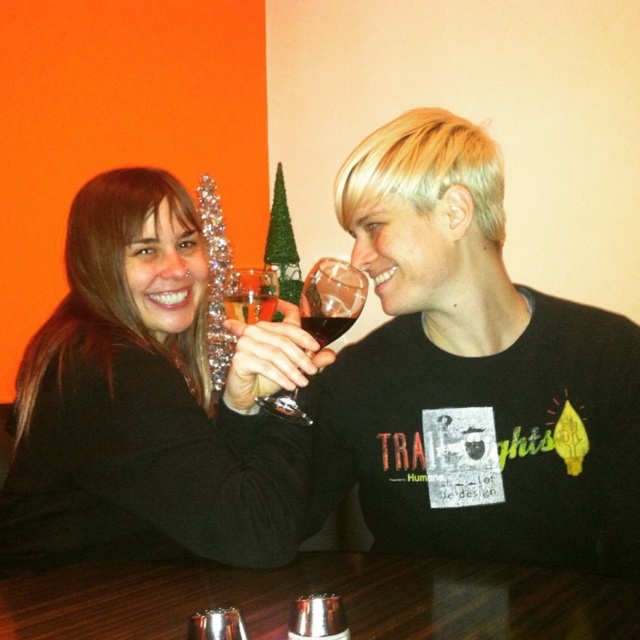
Between matte black shirt at center and translucent glass wine at center, which one appears on the left side from the viewer's perspective?

translucent glass wine at center is more to the left.

Does matte black shirt at center appear under translucent glass wine at center?

Yes.

What are the coordinates of `matte black shirt at center` in the screenshot? It's located at (472, 372).

Locate an element on the screen. matte black shirt at center is located at coordinates (x=472, y=372).

Which is in front, point (301, 493) or point (312, 273)?

Point (301, 493)

You are a GUI agent. You are given a task and a screenshot of the screen. Output one action in this format:
    pyautogui.click(x=<x>, y=<y>)
    Task: Click on the matte black wine glass at upper left
    
    Given the screenshot: What is the action you would take?
    pyautogui.click(x=140, y=404)

Locate an element on the screen. This screenshot has width=640, height=640. matte black wine glass at upper left is located at coordinates (140, 404).

Does wooden table at center have a lesser width compared to translucent glass wine at center?

No, wooden table at center is not thinner than translucent glass wine at center.

Is point (612, 604) more distant than point (330, 332)?

That is False.

You are a GUI agent. You are given a task and a screenshot of the screen. Output one action in this format:
    pyautogui.click(x=<x>, y=<y>)
    Task: Click on the wooden table at center
    The width and height of the screenshot is (640, 640).
    Given the screenshot: What is the action you would take?
    pyautogui.click(x=323, y=592)